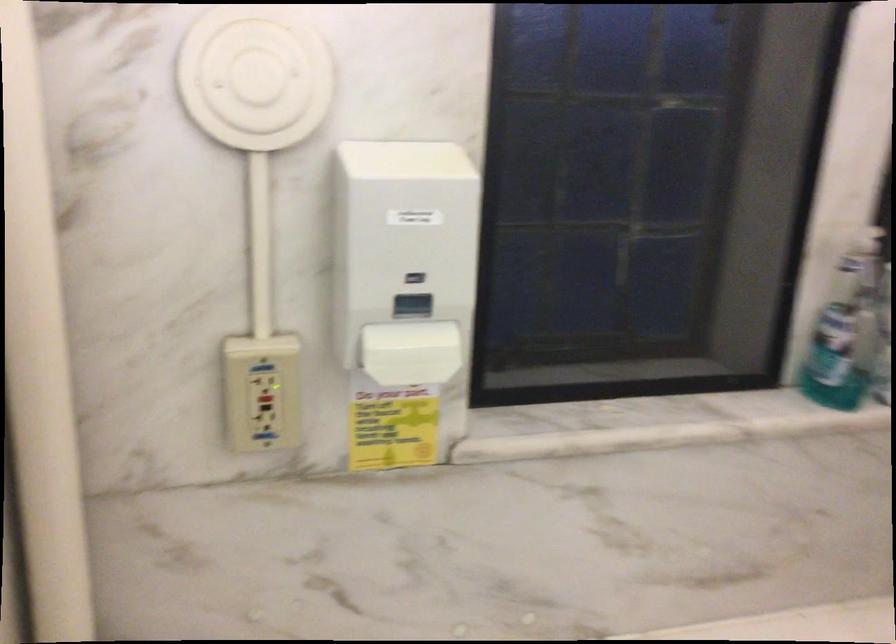
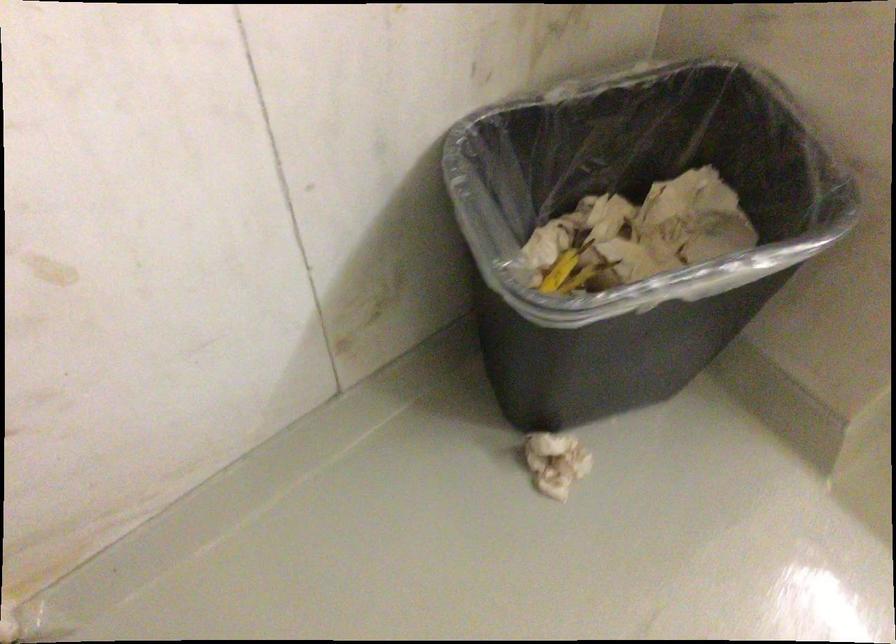
How did the camera likely rotate?

The camera's rotation is toward left-down.